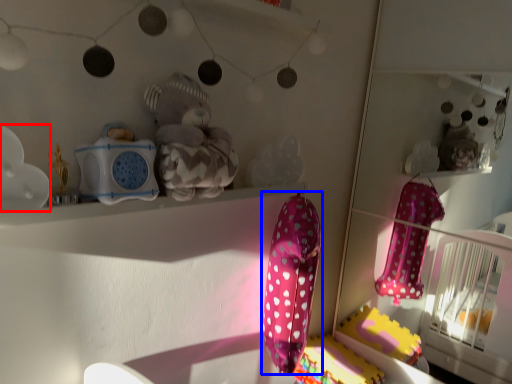
Question: Which object is closer to the camera taking this photo, toy (highlighted by a red box) or baby clothe (highlighted by a blue box)?

Choices:
 (A) toy
 (B) baby clothe

Answer: (A)